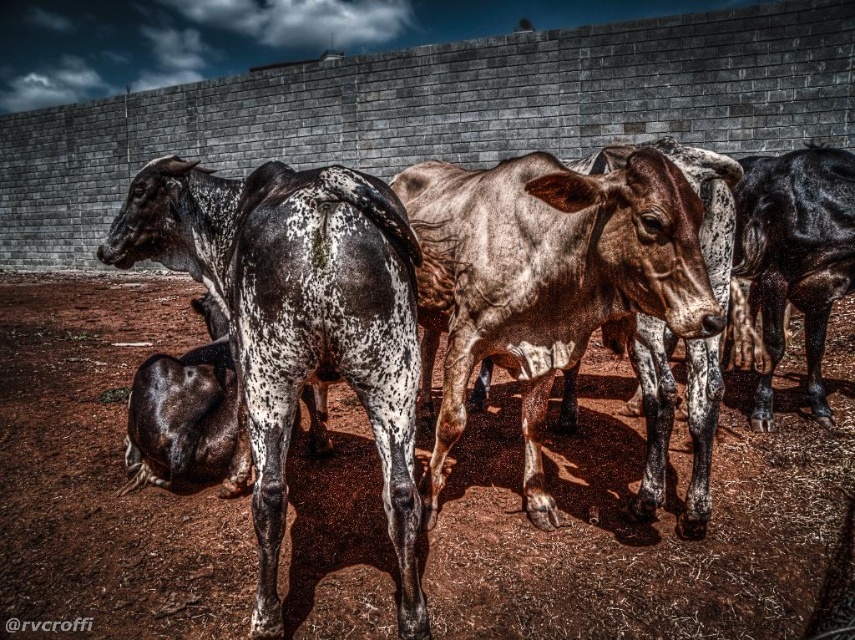
You are standing in the middle of the brown dirt field at center. Which direction should you walk to reach the cow with the black and white spotted coat that is facing away from you?

The cow with the black and white spotted coat is in the foreground, so you should walk towards the front of the brown dirt field at center to reach it.

You are a farmer checking the field. You see the brown dirt field at center and the speckled fur bull at center. Which one covers more horizontal space?

The brown dirt field at center covers more horizontal space than the speckled fur bull at center because its width is larger.

You are a farmer checking the field. You notice the brown dirt field at center and the speckled fur at center. Which object is closer to the ground?

The brown dirt field at center is closer to the ground because it is not as tall as the speckled fur at center.